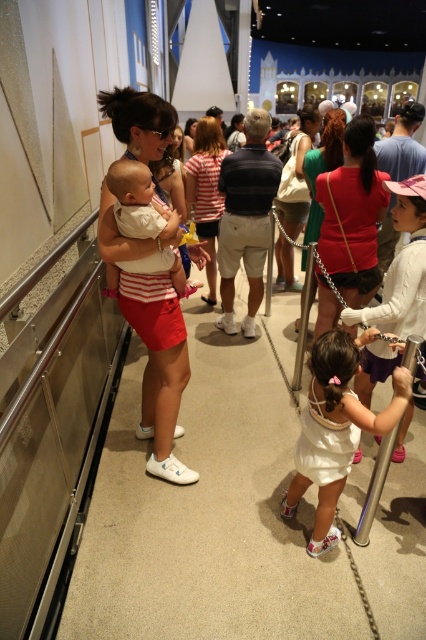
Question: Among these points, which one is nearest to the camera?

Choices:
 (A) (317, 502)
 (B) (143, 412)

Answer: (A)

Question: Does white fabric dress at center come in front of matte red shirt at center?

Choices:
 (A) no
 (B) yes

Answer: (B)

Question: From the image, what is the correct spatial relationship of white cotton baby at center in relation to matte white tank top at center?

Choices:
 (A) left
 (B) right

Answer: (A)

Question: Considering the relative positions of matte red shirt at center and matte green dress at center in the image provided, where is matte red shirt at center located with respect to matte green dress at center?

Choices:
 (A) left
 (B) right

Answer: (A)

Question: Which of these objects is positioned farthest from the matte white shorts at left?

Choices:
 (A) striped cotton shirt at center
 (B) matte red shirt at center
 (C) white fabric dress at center
 (D) white cotton baby at center

Answer: (A)

Question: Which of these objects is positioned closest to the white fabric dress at center?

Choices:
 (A) white cotton baby at center
 (B) matte red shirt at center
 (C) matte white tank top at center

Answer: (A)